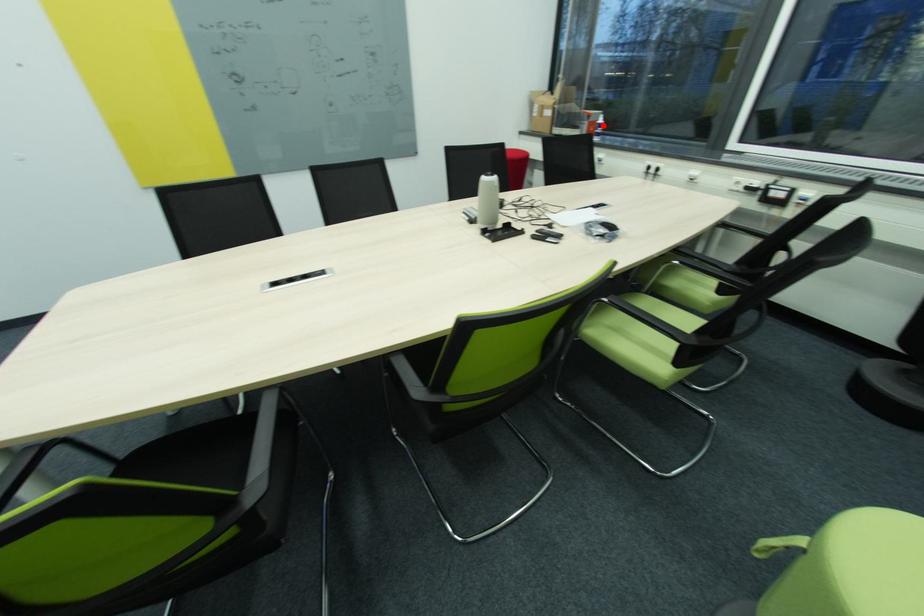
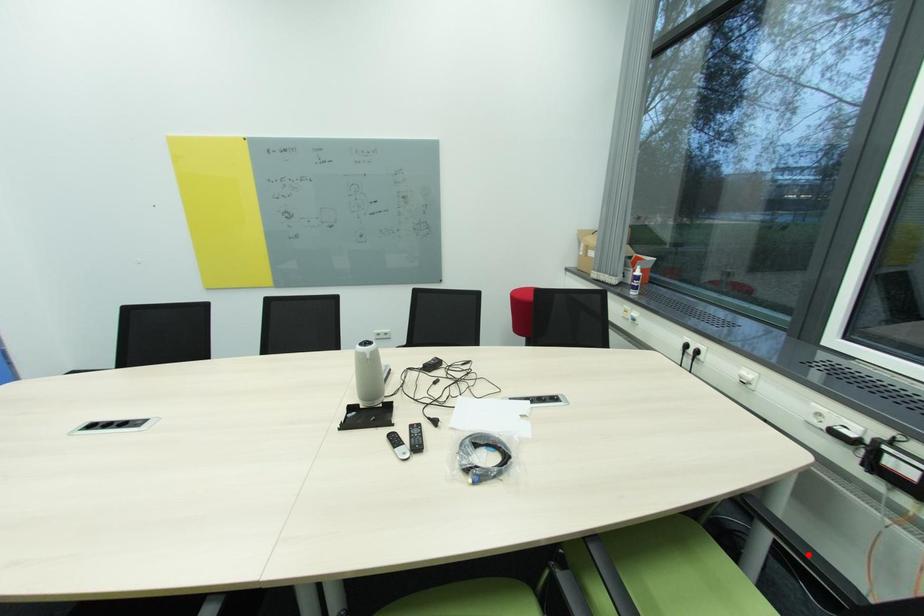
I am providing you with two images of the same scene from different viewpoints. A red point is marked on the first image and another point is marked on the second image. Is the red point in image1 aligned with the point shown in image2?

No